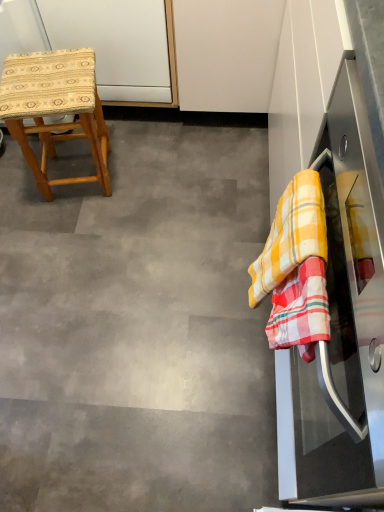
Question: From the image's perspective, is wooden woven stool at left under stainless steel oven at right?

Choices:
 (A) no
 (B) yes

Answer: (A)

Question: Is wooden woven stool at left far from stainless steel oven at right?

Choices:
 (A) yes
 (B) no

Answer: (A)

Question: From a real-world perspective, is wooden woven stool at left beneath stainless steel oven at right?

Choices:
 (A) yes
 (B) no

Answer: (A)

Question: Considering the relative sizes of wooden woven stool at left and stainless steel oven at right in the image provided, is wooden woven stool at left shorter than stainless steel oven at right?

Choices:
 (A) yes
 (B) no

Answer: (A)

Question: Is wooden woven stool at left behind stainless steel oven at right?

Choices:
 (A) yes
 (B) no

Answer: (A)

Question: Does wooden woven stool at left come in front of stainless steel oven at right?

Choices:
 (A) yes
 (B) no

Answer: (B)

Question: Can you confirm if stainless steel oven at right is smaller than yellow checkered cloth at right?

Choices:
 (A) no
 (B) yes

Answer: (A)

Question: From the image's perspective, does stainless steel oven at right appear lower than yellow checkered cloth at right?

Choices:
 (A) yes
 (B) no

Answer: (A)

Question: Does stainless steel oven at right have a greater width compared to yellow checkered cloth at right?

Choices:
 (A) no
 (B) yes

Answer: (B)

Question: Is stainless steel oven at right further to the viewer compared to yellow checkered cloth at right?

Choices:
 (A) no
 (B) yes

Answer: (A)

Question: Is stainless steel oven at right turned away from yellow checkered cloth at right?

Choices:
 (A) yes
 (B) no

Answer: (A)

Question: From the image's perspective, is stainless steel oven at right over yellow checkered cloth at right?

Choices:
 (A) no
 (B) yes

Answer: (A)

Question: Is wooden woven stool at left with yellow checkered cloth at right?

Choices:
 (A) yes
 (B) no

Answer: (B)